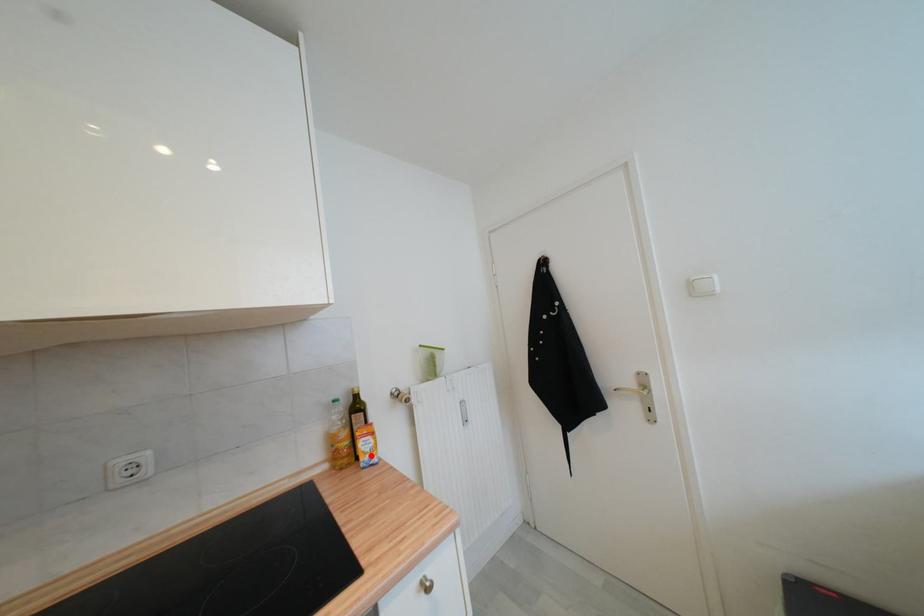
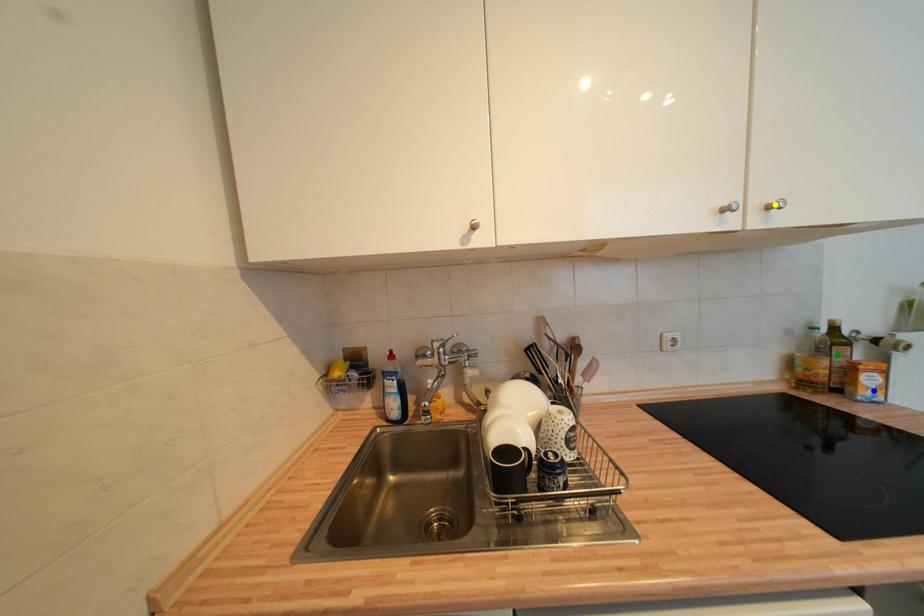
Question: I am providing you with two images of the same scene from different viewpoints. A red point is marked on the first image. You are given multiple points on the second image. Which point in image 2 is actually the same real-world point as the red point in image 1?

Choices:
 (A) yellow point
 (B) green point
 (C) blue point

Answer: (C)